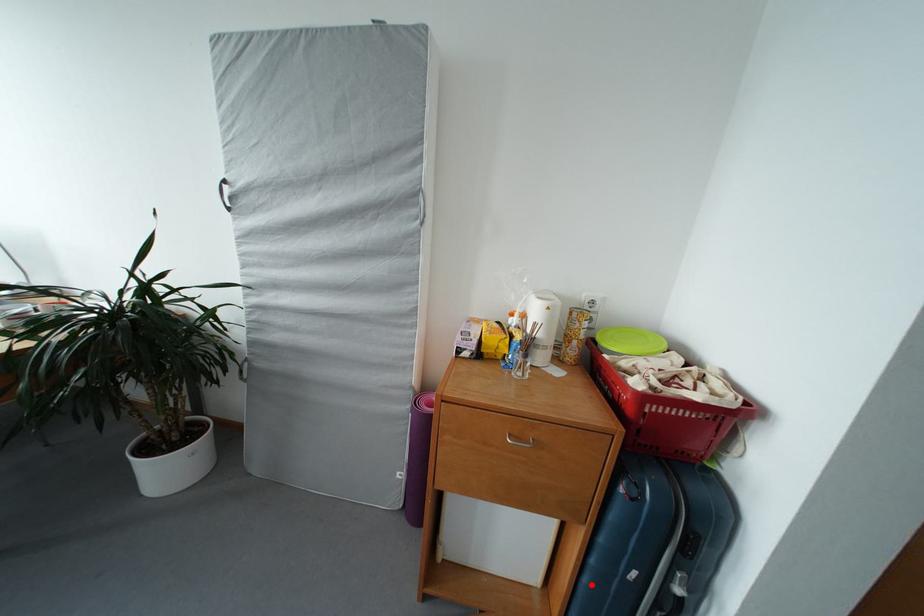
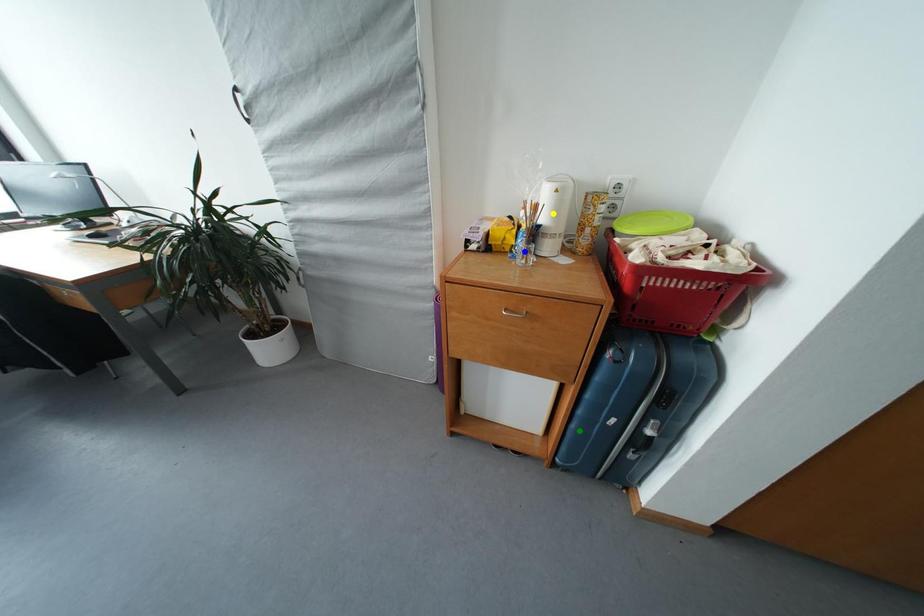
Question: I am providing you with two images of the same scene from different viewpoints. A red point is marked on the first image. You are given multiple points on the second image. In image 2, which mark is for the same physical point as the one in image 1?

Choices:
 (A) green point
 (B) blue point
 (C) yellow point

Answer: (A)